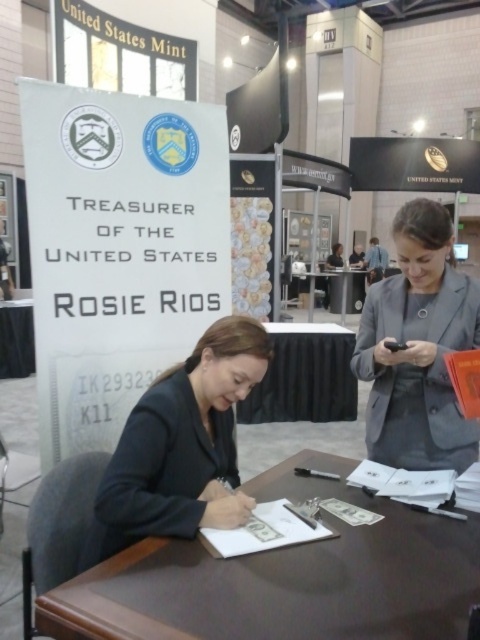
Question: Is smooth brown table at center closer to the viewer compared to black glossy table at lower left?

Choices:
 (A) yes
 (B) no

Answer: (A)

Question: Which point is farther to the camera?

Choices:
 (A) black matte blazer at center
 (B) smooth brown table at center
 (C) black glossy table at lower left

Answer: (C)

Question: Which of the following is the closest to the observer?

Choices:
 (A) black matte blazer at center
 (B) brown wood table at center
 (C) black glossy table at lower left

Answer: (B)

Question: From the image, what is the correct spatial relationship of smooth brown table at center in relation to black glossy table at lower left?

Choices:
 (A) left
 (B) right

Answer: (B)

Question: Can you confirm if black matte blazer at center is smaller than gray fabric jacket at upper right?

Choices:
 (A) yes
 (B) no

Answer: (A)

Question: Considering the real-world distances, which object is farthest from the black matte blazer at center?

Choices:
 (A) gray fabric jacket at upper right
 (B) black glossy table at lower left
 (C) smooth brown table at center

Answer: (B)